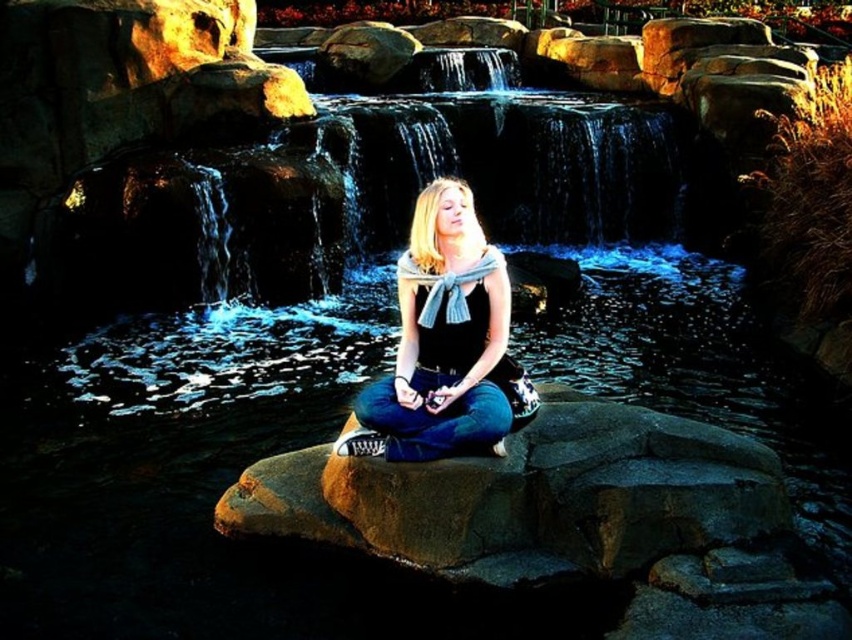
Is point (459, 468) positioned in front of point (373, 456)?

That is True.

Where is `brown rough rock at center`? brown rough rock at center is located at coordinates (528, 497).

This screenshot has height=640, width=852. I want to click on brown rough rock at center, so click(528, 497).